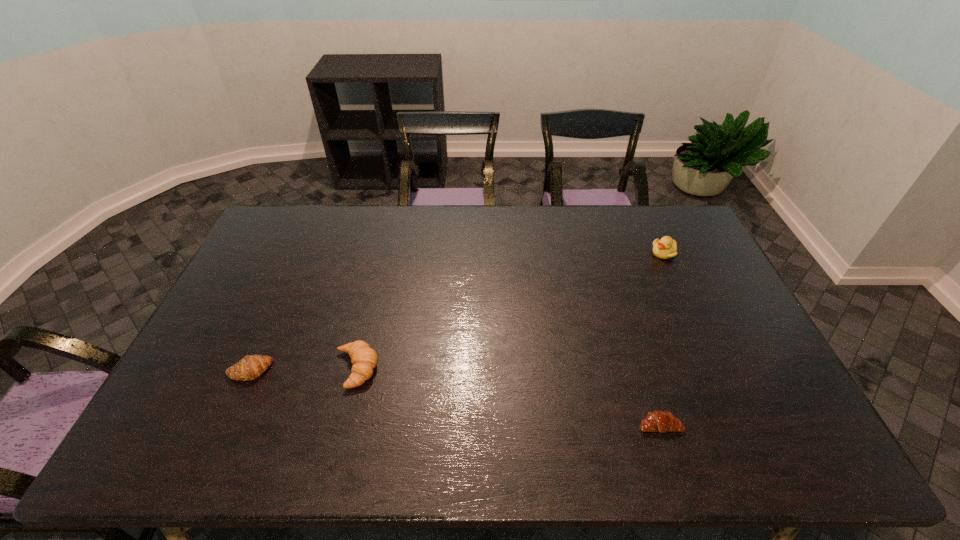
I want to click on the tallest object, so click(x=665, y=248).

Image resolution: width=960 pixels, height=540 pixels. Find the location of `the rightmost object`. the rightmost object is located at coordinates (665, 248).

The image size is (960, 540). I want to click on the second crescent roll from right to left, so click(363, 358).

This screenshot has height=540, width=960. I want to click on the second object from left to right, so click(x=363, y=358).

Where is `the leftmost crescent roll`? This screenshot has width=960, height=540. the leftmost crescent roll is located at coordinates (252, 367).

Locate an element on the screen. This screenshot has width=960, height=540. the leftmost object is located at coordinates (252, 367).

Locate an element on the screen. The width and height of the screenshot is (960, 540). the rightmost crescent roll is located at coordinates (660, 421).

The height and width of the screenshot is (540, 960). Identify the location of the nearest crescent roll. (660, 421).

The width and height of the screenshot is (960, 540). What are the coordinates of `vacant region located 0.090m on the beak of the duckling` in the screenshot? It's located at (626, 253).

In order to click on vacant space located 0.280m on the beak of the duckling in this screenshot , I will do `click(572, 253)`.